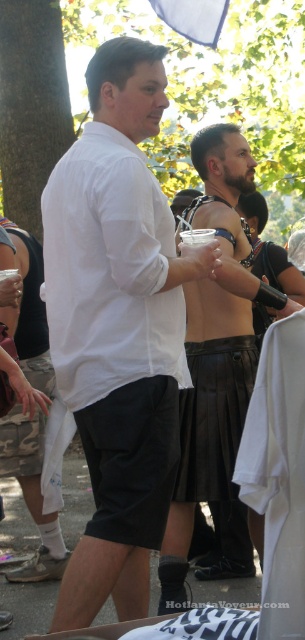
Who is higher up, white matte shirt at center or white cotton shirt at center?

white cotton shirt at center is higher up.

Is point (122, 154) more distant than point (75, 396)?

No, (122, 154) is closer to viewer.

Does point (160, 237) lie behind point (131, 358)?

Yes, it is.

Identify the location of white matte shirt at center. (118, 326).

Does white matte shirt at center have a greater width compared to leather kilt at center?

Yes.

In the scene shown: Can you confirm if white matte shirt at center is bigger than leather kilt at center?

No.

Identify the location of white matte shirt at center. (118, 326).

Find the location of a particular element. white matte shirt at center is located at coordinates (118, 326).

Image resolution: width=305 pixels, height=640 pixels. Describe the element at coordinates (108, 269) in the screenshot. I see `white cotton shirt at center` at that location.

Can you confirm if white cotton shirt at center is wider than leather kilt at center?

No, white cotton shirt at center is not wider than leather kilt at center.

Who is more distant from viewer, (57,180) or (187,419)?

The point (187,419) is behind.

Locate an element on the screen. white cotton shirt at center is located at coordinates (108, 269).